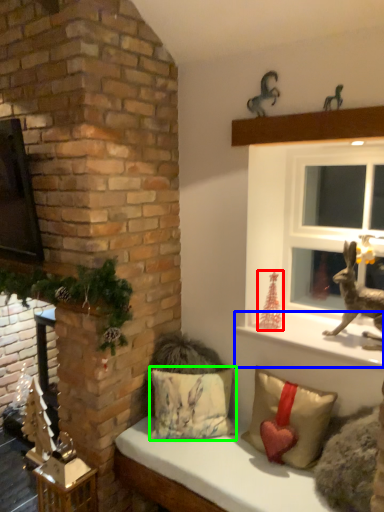
Question: Based on their relative distances, which object is nearer to christmas decoration (highlighted by a red box)? Choose from window sill (highlighted by a blue box) and pillow (highlighted by a green box).

Choices:
 (A) window sill
 (B) pillow

Answer: (A)